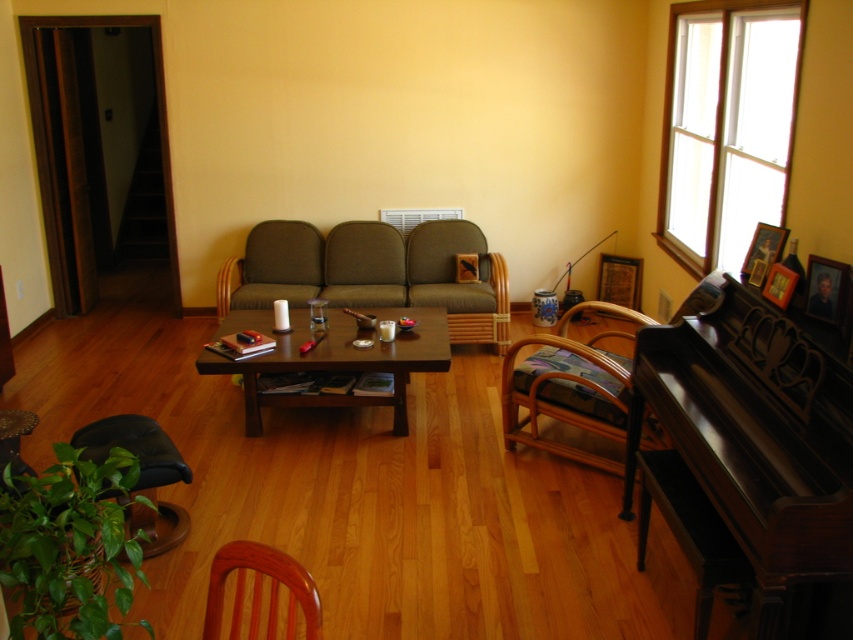
You are a guest in the living room and want to see the view outside the white wooden window at upper right. However, the dark polished wood piano at right is blocking your view. Can you move around the piano to see the window?

The dark polished wood piano at right is in front of the white wooden window at upper right, so you can move around the sides of the piano to see the window since it is blocking the direct view.

You are a delivery person who needs to place a large package that is 3 feet wide between the green fabric couch at center and the brown wooden table at center. Can you fit the package there?

The distance between the green fabric couch at center and the brown wooden table at center is 33.44 inches, which is approximately 2.78 feet. Since the package is 3 feet wide, it is slightly wider than the available space. Therefore, the package cannot be placed between them.